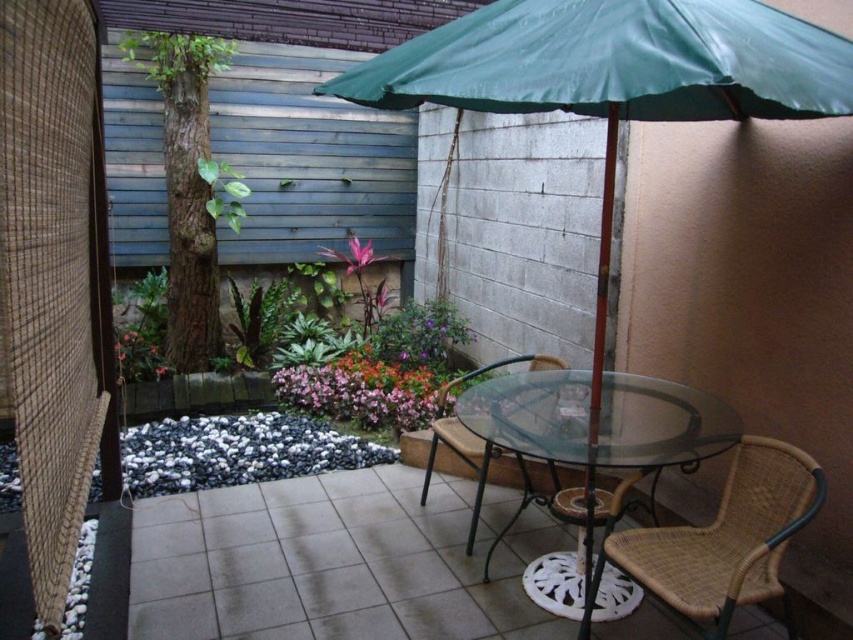
Between point (279, 282) and point (222, 164), which one is positioned behind?

Positioned behind is point (279, 282).

Which is in front, point (253, 353) or point (218, 196)?

Positioned in front is point (253, 353).

Where is `green glossy leafy plant at center-left`? green glossy leafy plant at center-left is located at coordinates point(260,317).

Is point (399, 429) less distant than point (212, 188)?

Yes, point (399, 429) is in front of point (212, 188).

Does point (283, 369) come farther from viewer compared to point (230, 209)?

No.

I want to click on vivid green leaves at center, so click(363, 392).

Image resolution: width=853 pixels, height=640 pixels. Find the location of `vivid green leaves at center`. vivid green leaves at center is located at coordinates (363, 392).

Can you confirm if woven rattan chair at lower right is positioned to the right of woven rattan chair at center?

Indeed, woven rattan chair at lower right is positioned on the right side of woven rattan chair at center.

Can you confirm if woven rattan chair at lower right is positioned above woven rattan chair at center?

Incorrect, woven rattan chair at lower right is not positioned above woven rattan chair at center.

From the picture: Who is more forward, (602, 548) or (482, 472)?

Point (602, 548) is more forward.

You are a GUI agent. You are given a task and a screenshot of the screen. Output one action in this format:
    pyautogui.click(x=<x>, y=<y>)
    Task: Click on the woven rattan chair at lower right
    
    Given the screenshot: What is the action you would take?
    pyautogui.click(x=720, y=540)